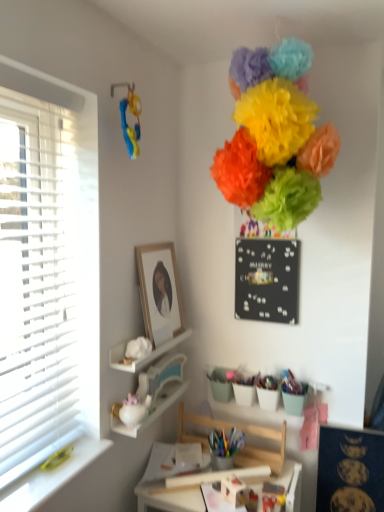
Where is `wooden framed portrait at upper center`? This screenshot has width=384, height=512. wooden framed portrait at upper center is located at coordinates (159, 291).

Find the location of a particular element. white glossy teapot at lower left, marked as the 1th shelf in a bottom-to-top arrangement is located at coordinates (147, 356).

Describe the element at coordinates (168, 498) in the screenshot. This screenshot has width=384, height=512. I see `wooden desk at center` at that location.

What do you see at coordinates (350, 471) in the screenshot? I see `dark blue matte bulletin board at upper right, which is counted as the 1th bulletin board, starting from the bottom` at bounding box center [350, 471].

You are a GUI agent. You are given a task and a screenshot of the screen. Output one action in this format:
    pyautogui.click(x=<x>, y=<y>)
    Task: Click on the wooden framed portrait at upper center
    
    Given the screenshot: What is the action you would take?
    pyautogui.click(x=159, y=291)

Between white glossy teapot at lower left, marked as the 1th shelf in a bottom-to-top arrangement, and black matte bulletin board at upper center, the 2th bulletin board when ordered from right to left, which one appears on the right side from the viewer's perspective?

black matte bulletin board at upper center, the 2th bulletin board when ordered from right to left, is more to the right.

From a real-world perspective, who is located higher, white glossy teapot at lower left, marked as the 1th shelf in a bottom-to-top arrangement, or black matte bulletin board at upper center, which ranks as the first bulletin board in top-to-bottom order?

black matte bulletin board at upper center, which ranks as the first bulletin board in top-to-bottom order.

Is white glossy teapot at lower left, marked as the 1th shelf in a bottom-to-top arrangement, smaller than black matte bulletin board at upper center, arranged as the first bulletin board when viewed from the left?

Yes, white glossy teapot at lower left, marked as the 1th shelf in a bottom-to-top arrangement, is smaller than black matte bulletin board at upper center, arranged as the first bulletin board when viewed from the left.

Which object is thinner, white glossy teapot at lower left, marked as the 1th shelf in a bottom-to-top arrangement, or black matte bulletin board at upper center, the 2th bulletin board when ordered from right to left?

black matte bulletin board at upper center, the 2th bulletin board when ordered from right to left.

Does point (297, 477) come closer to viewer compared to point (152, 271)?

No.

Measure the distance between wooden desk at center and wooden framed portrait at upper center.

They are 35.16 inches apart.

Is wooden desk at center further to the viewer compared to wooden framed portrait at upper center?

No, the depth of wooden desk at center is less than that of wooden framed portrait at upper center.

From a real-world perspective, between wooden desk at center and wooden framed portrait at upper center, who is vertically lower?

wooden desk at center is physically lower.

Is white matte shelf at lower center, which is the second shelf in bottom-to-top order, positioned in front of wooden framed portrait at upper center?

Yes.

From a real-world perspective, is white matte shelf at lower center, which is the second shelf in bottom-to-top order, above or below wooden framed portrait at upper center?

In terms of real-world spatial position, white matte shelf at lower center, which is the second shelf in bottom-to-top order, is below wooden framed portrait at upper center.

Which of these two, white matte shelf at lower center, which is the second shelf in bottom-to-top order, or wooden framed portrait at upper center, is wider?

white matte shelf at lower center, which is the second shelf in bottom-to-top order, is wider.

From the image's perspective, which shelf is the 1st one below the wooden framed portrait at upper center? Please provide its 2D coordinates.

[(145, 357)]

Is wooden framed portrait at upper center positioned far away from white matte shelf at lower center, which is the second shelf in bottom-to-top order?

No, there isn't a large distance between wooden framed portrait at upper center and white matte shelf at lower center, which is the second shelf in bottom-to-top order.

In the scene shown: Is wooden framed portrait at upper center bigger or smaller than white matte shelf at lower center, the 1th shelf in the top-to-bottom sequence?

wooden framed portrait at upper center is bigger than white matte shelf at lower center, the 1th shelf in the top-to-bottom sequence.

Consider the image. Can you confirm if wooden framed portrait at upper center is shorter than white matte shelf at lower center, which is the second shelf in bottom-to-top order?

No, wooden framed portrait at upper center is not shorter than white matte shelf at lower center, which is the second shelf in bottom-to-top order.

Can you confirm if wooden framed portrait at upper center is wider than white matte shelf at lower center, the 1th shelf in the top-to-bottom sequence?

No.

From the image's perspective, is wooden desk at center above wooden swivel chair at center?

No, from the image's perspective, wooden desk at center is not above wooden swivel chair at center.

Is wooden desk at center spatially inside wooden swivel chair at center, or outside of it?

wooden desk at center is spatially situated outside wooden swivel chair at center.

From the picture: Is wooden desk at center looking in the opposite direction of wooden swivel chair at center?

No, wooden desk at center's orientation is not away from wooden swivel chair at center.

The width and height of the screenshot is (384, 512). Find the location of `swivel chair on the right of wooden desk at center`. swivel chair on the right of wooden desk at center is located at coordinates (262, 449).

Identify the location of swivel chair below the black matte bulletin board at upper center, the 2th bulletin board when ordered from right to left (from a real-world perspective). The image size is (384, 512). (262, 449).

Is the depth of wooden swivel chair at center less than that of black matte bulletin board at upper center, the 2th bulletin board when ordered from right to left?

That is True.

Is point (266, 451) closer or farther from the camera than point (246, 296)?

Clearly, point (266, 451) is closer to the camera than point (246, 296).

From a real-world perspective, is white glossy teapot at lower left, acting as the second shelf starting from the top, above or below wooden framed portrait at upper center?

In terms of real-world spatial position, white glossy teapot at lower left, acting as the second shelf starting from the top, is below wooden framed portrait at upper center.

Which is correct: white glossy teapot at lower left, acting as the second shelf starting from the top, is inside wooden framed portrait at upper center, or outside of it?

white glossy teapot at lower left, acting as the second shelf starting from the top, is located beyond the bounds of wooden framed portrait at upper center.

Is white glossy teapot at lower left, marked as the 1th shelf in a bottom-to-top arrangement, facing away from wooden framed portrait at upper center?

white glossy teapot at lower left, marked as the 1th shelf in a bottom-to-top arrangement, is not turned away from wooden framed portrait at upper center.

Considering the sizes of white glossy teapot at lower left, acting as the second shelf starting from the top, and wooden framed portrait at upper center in the image, is white glossy teapot at lower left, acting as the second shelf starting from the top, taller or shorter than wooden framed portrait at upper center?

Considering their sizes, white glossy teapot at lower left, acting as the second shelf starting from the top, has less height than wooden framed portrait at upper center.

The image size is (384, 512). Identify the location of the 2nd bulletin board behind the white glossy teapot at lower left, marked as the 1th shelf in a bottom-to-top arrangement. (267, 280).

I want to click on table that appears below the wooden framed portrait at upper center (from the image's perspective), so click(168, 498).

Which object lies nearer to the anchor point matte paper pom-poms at upper center, dark blue matte bulletin board at upper right, which is counted as the 1th bulletin board, starting from the bottom, or wooden swivel chair at center?

dark blue matte bulletin board at upper right, which is counted as the 1th bulletin board, starting from the bottom, is positioned closer to the anchor matte paper pom-poms at upper center.

Which object lies nearer to the anchor point white matte shelf at lower center, the 1th shelf in the top-to-bottom sequence, dark blue matte bulletin board at upper right, the 2th bulletin board viewed from the top, or matte paper pom-poms at upper center?

dark blue matte bulletin board at upper right, the 2th bulletin board viewed from the top.

When comparing their distances from wooden desk at center, does matte paper pom-poms at upper center or dark blue matte bulletin board at upper right, positioned as the first bulletin board in right-to-left order, seem closer?

dark blue matte bulletin board at upper right, positioned as the first bulletin board in right-to-left order.

From the image, which object appears to be farther from wooden desk at center, white matte shelf at lower center, the 1th shelf in the top-to-bottom sequence, or matte paper pom-poms at upper center?

matte paper pom-poms at upper center is further to wooden desk at center.

Considering their positions, is matte paper pom-poms at upper center positioned further to wooden swivel chair at center than white matte shelf at lower center, which is the second shelf in bottom-to-top order?

matte paper pom-poms at upper center is positioned further to the anchor wooden swivel chair at center.

Estimate the real-world distances between objects in this image. Which object is further from wooden swivel chair at center, dark blue matte bulletin board at upper right, positioned as the first bulletin board in right-to-left order, or white glossy teapot at lower left, acting as the second shelf starting from the top?

Among the two, white glossy teapot at lower left, acting as the second shelf starting from the top, is located further to wooden swivel chair at center.

From the image, which object appears to be nearer to wooden desk at center, dark blue matte bulletin board at upper right, the 2th bulletin board viewed from the top, or matte paper pom-poms at upper center?

dark blue matte bulletin board at upper right, the 2th bulletin board viewed from the top.

When comparing their distances from matte paper pom-poms at upper center, does dark blue matte bulletin board at upper right, which appears as the second bulletin board when viewed from the left, or wooden framed portrait at upper center seem further?

Based on the image, dark blue matte bulletin board at upper right, which appears as the second bulletin board when viewed from the left, appears to be further to matte paper pom-poms at upper center.

This screenshot has height=512, width=384. What are the coordinates of `picture frame between matte paper pom-poms at upper center and wooden desk at center from top to bottom` in the screenshot? It's located at (159, 291).

Image resolution: width=384 pixels, height=512 pixels. Find the location of `bulletin board between wooden framed portrait at upper center and wooden desk at center vertically`. bulletin board between wooden framed portrait at upper center and wooden desk at center vertically is located at coordinates (350, 471).

The image size is (384, 512). In order to click on picture frame between matte paper pom-poms at upper center and wooden swivel chair at center from top to bottom in this screenshot , I will do `click(159, 291)`.

At what (x,y) coordinates should I click in order to perform the action: click on picture frame located between white matte shelf at lower center, which is the second shelf in bottom-to-top order, and black matte bulletin board at upper center, the 2th bulletin board when ordered from right to left, in the left-right direction. Please return your answer as a coordinate pair (x, y). The image size is (384, 512). Looking at the image, I should click on (159, 291).